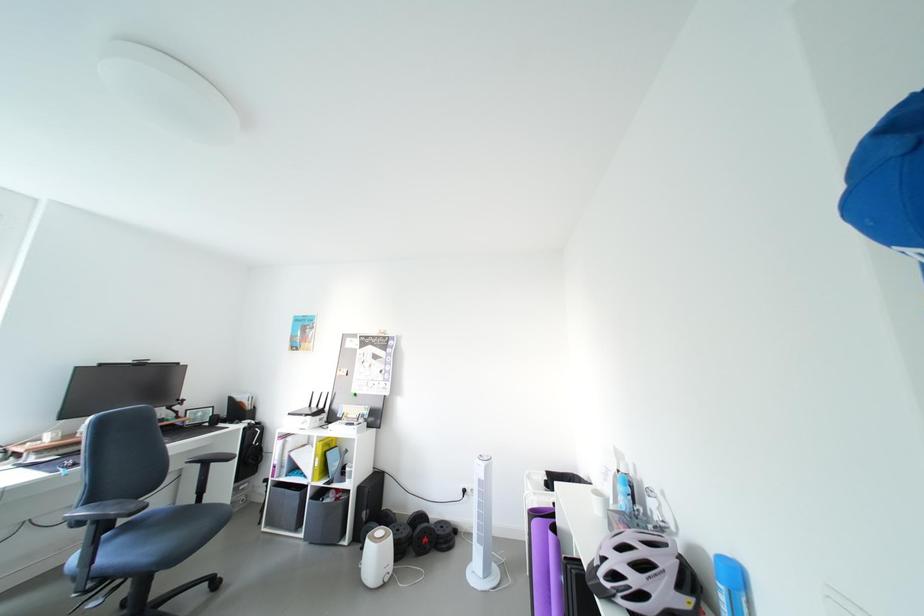
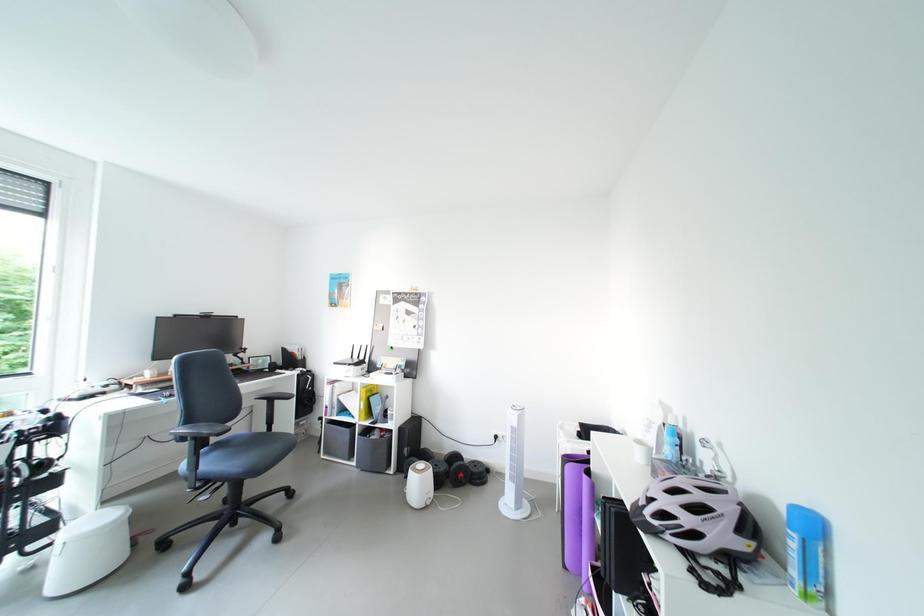
Question: The first image is from the beginning of the video and the second image is from the end. How did the camera likely rotate when shooting the video?

Choices:
 (A) Left
 (B) Right
 (C) Up
 (D) Down

Answer: (D)